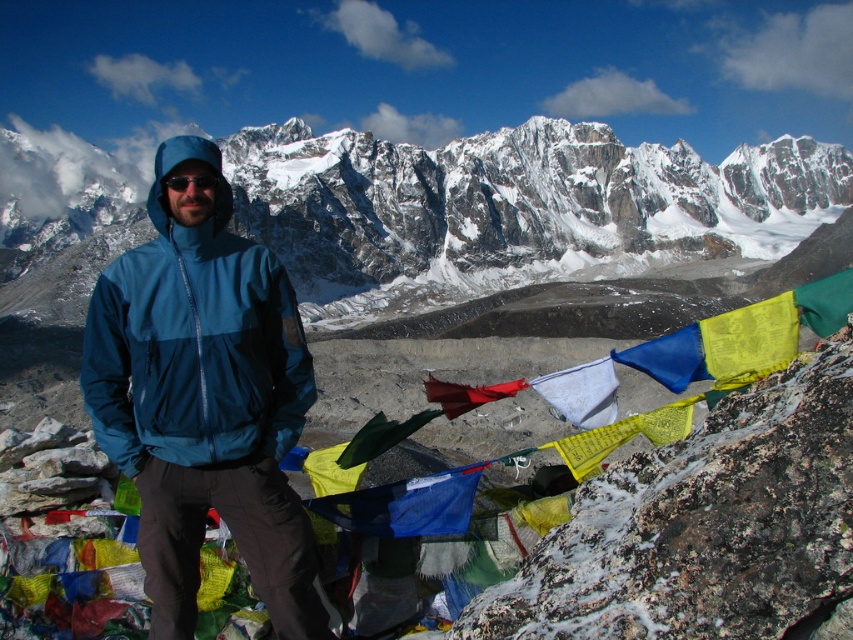
Who is taller, blue waterproof jacket at center or red fabric flag at center?

With more height is blue waterproof jacket at center.

Is point (225, 260) positioned before point (498, 397)?

Yes.

Who is more forward, (216, 420) or (467, 403)?

Positioned in front is point (216, 420).

You are a GUI agent. You are given a task and a screenshot of the screen. Output one action in this format:
    pyautogui.click(x=<x>, y=<y>)
    Task: Click on the blue waterproof jacket at center
    The width and height of the screenshot is (853, 640).
    Given the screenshot: What is the action you would take?
    pyautogui.click(x=194, y=336)

How distant is matte blue jacket at center from blue waterproof jacket at center?

matte blue jacket at center and blue waterproof jacket at center are 94.15 meters apart.

Which is above, matte blue jacket at center or blue waterproof jacket at center?

matte blue jacket at center is higher up.

Find the location of a particular element. Image resolution: width=853 pixels, height=640 pixels. matte blue jacket at center is located at coordinates (508, 209).

Does point (608, 488) lie behind point (514, 385)?

No, it is in front of (514, 385).

Is textured rock at center below red fabric flag at center?

Correct, textured rock at center is located below red fabric flag at center.

At what (x,y) coordinates should I click in order to perform the action: click on textured rock at center. Please return your answer as a coordinate pair (x, y). This screenshot has height=640, width=853. Looking at the image, I should click on point(703,525).